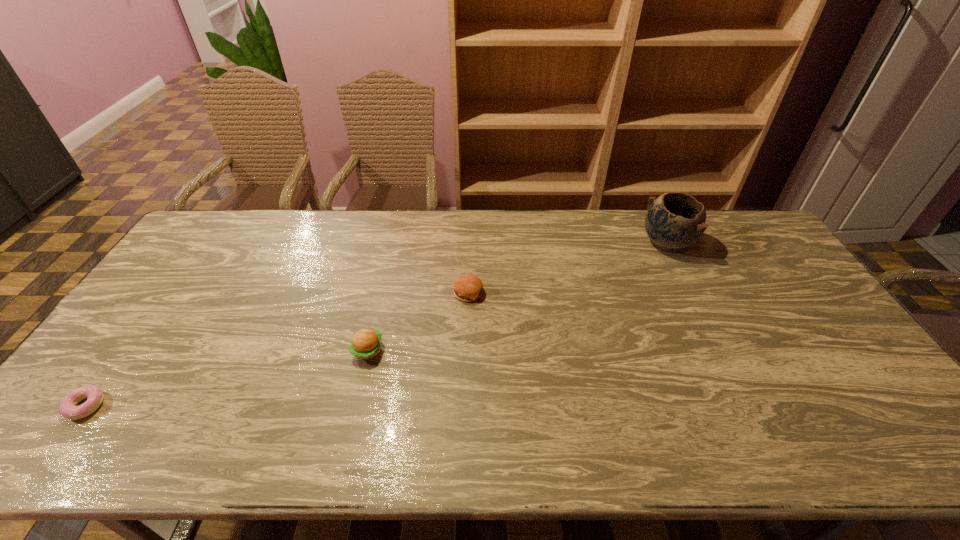
This screenshot has width=960, height=540. What are the coordinates of `vacant area that lies between the second shortest object and the nearer hamburger` in the screenshot? It's located at (418, 322).

You are a GUI agent. You are given a task and a screenshot of the screen. Output one action in this format:
    pyautogui.click(x=<x>, y=<y>)
    Task: Click on the vacant point located between the second object from right to left and the third object from right to left
    This screenshot has width=960, height=540.
    Given the screenshot: What is the action you would take?
    pyautogui.click(x=418, y=322)

Identify the location of free area in between the third shortest object and the right hamburger. (418, 322).

At what (x,y) coordinates should I click in order to perform the action: click on free space between the nearest object and the left hamburger. Please return your answer as a coordinate pair (x, y). Looking at the image, I should click on (227, 379).

Where is `free space between the shortest object and the farther hamburger`? The height and width of the screenshot is (540, 960). free space between the shortest object and the farther hamburger is located at coordinates (277, 349).

Identify the location of vacant area that lies between the shortest object and the farther hamburger. (277, 349).

In order to click on blank region between the second object from left to right and the third nearest object in this screenshot , I will do `click(418, 322)`.

Locate an element on the screen. unoccupied area between the farther hamburger and the doughnut is located at coordinates (277, 349).

Identify the location of empty space that is in between the shorter hamburger and the taller hamburger. (418, 322).

Locate an element on the screen. This screenshot has height=540, width=960. free area in between the taller hamburger and the third nearest object is located at coordinates (418, 322).